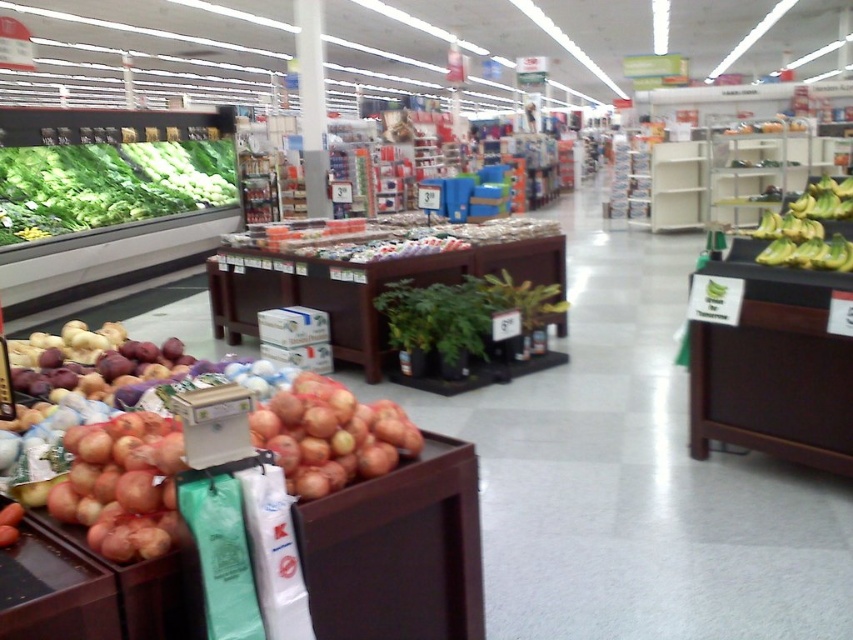
You are a customer in the grocery store and want to pick up both items located at point [225,173] and point [152,512]. Which point should you approach first if you want to follow the store layout from front to back?

You should approach point [152,512] first because point [225,173] is behind it, meaning the store layout places point [152,512] closer to the front.

You are standing in the grocery store and want to pick up an item from point (408, 419) and then move to point (807, 243). Which point will require bending down more?

Point (807, 243) requires bending down more because it is further away from the camera compared to point (408, 419), which is closer and might be at a more accessible height.

You are a customer in the grocery store and want to buy both the ripe red onions at lower left and the yellow smooth bananas at right. Which of these items has a smaller width?

The ripe red onions at lower left has a smaller width than the yellow smooth bananas at right.